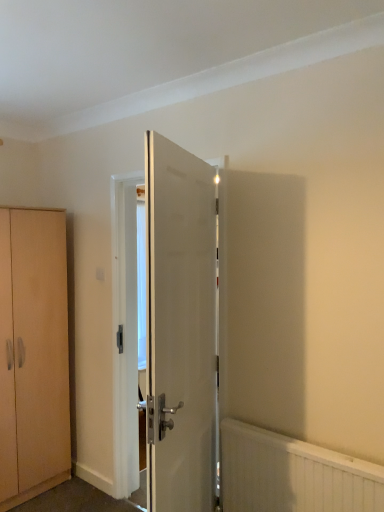
Question: Is point (8, 318) positioned closer to the camera than point (185, 399)?

Choices:
 (A) closer
 (B) farther

Answer: (B)

Question: Based on their positions, is light brown wood cabinet at left located to the left or right of white glossy door at center?

Choices:
 (A) left
 (B) right

Answer: (A)

Question: Which of these objects is positioned farthest from the light brown wood cabinet at left?

Choices:
 (A) white glossy door at center
 (B) white textured radiator at lower right

Answer: (B)

Question: Which object is positioned farthest from the white textured radiator at lower right?

Choices:
 (A) light brown wood cabinet at left
 (B) white glossy door at center

Answer: (A)